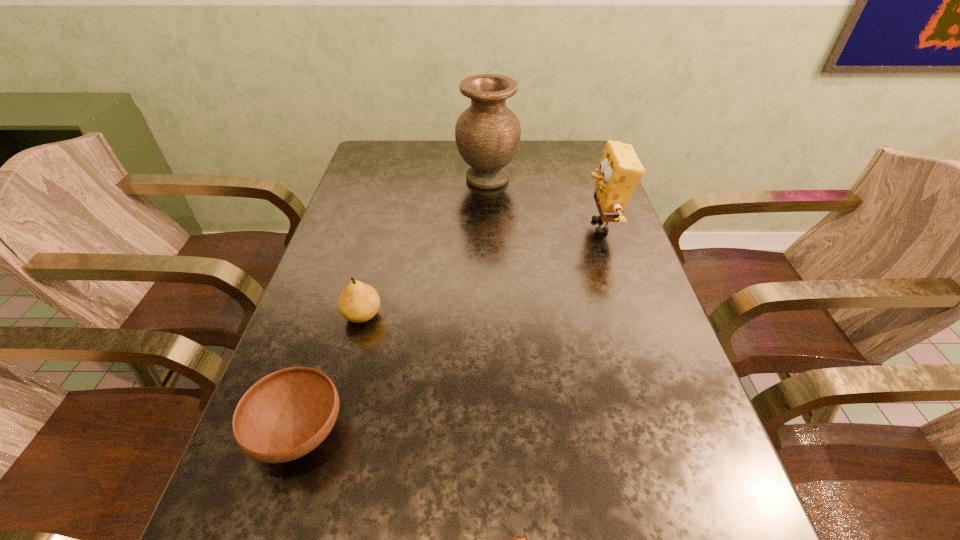
Identify the location of free space located on the face of the fourth nearest object. (516, 226).

This screenshot has height=540, width=960. I want to click on free location located 0.290m on the face of the fourth nearest object, so click(x=474, y=226).

This screenshot has width=960, height=540. Identify the location of free region located 0.160m on the back of the third farthest object. (378, 255).

Find the location of a particular element. The height and width of the screenshot is (540, 960). vacant space positioned on the right of the fourth farthest object is located at coordinates (492, 434).

Where is `object present at the far edge`? object present at the far edge is located at coordinates (487, 134).

Locate an element on the screen. Image resolution: width=960 pixels, height=540 pixels. pear present at the left edge is located at coordinates (359, 302).

You are a GUI agent. You are given a task and a screenshot of the screen. Output one action in this format:
    pyautogui.click(x=<x>, y=<y>)
    Task: Click on the bowl situated at the left edge
    This screenshot has height=540, width=960.
    Given the screenshot: What is the action you would take?
    pyautogui.click(x=285, y=415)

This screenshot has height=540, width=960. Find the location of `object that is at the right edge`. object that is at the right edge is located at coordinates (620, 171).

The height and width of the screenshot is (540, 960). In the image, there is a desktop. Identify the location of free space at the far edge. (453, 146).

The image size is (960, 540). I want to click on vacant space at the left edge, so click(326, 256).